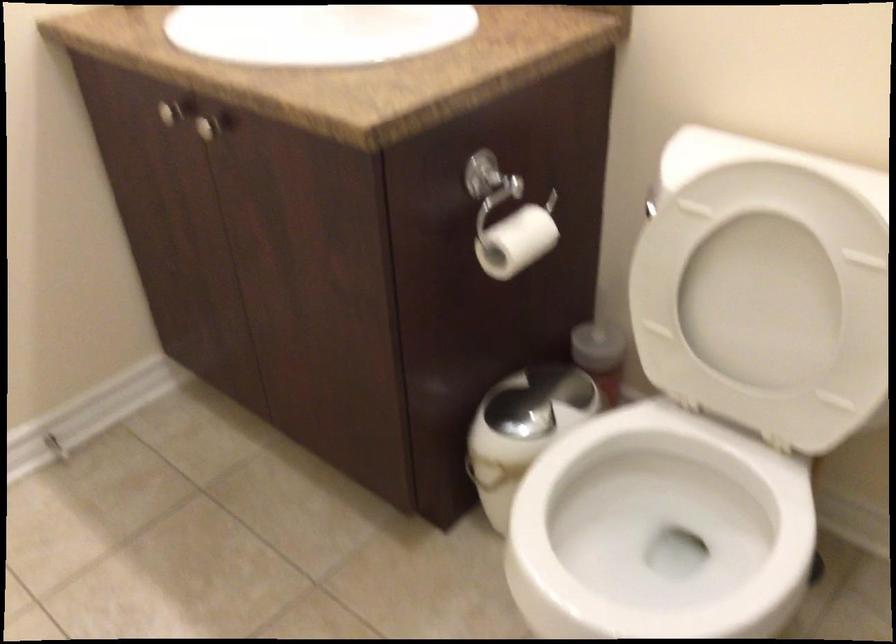
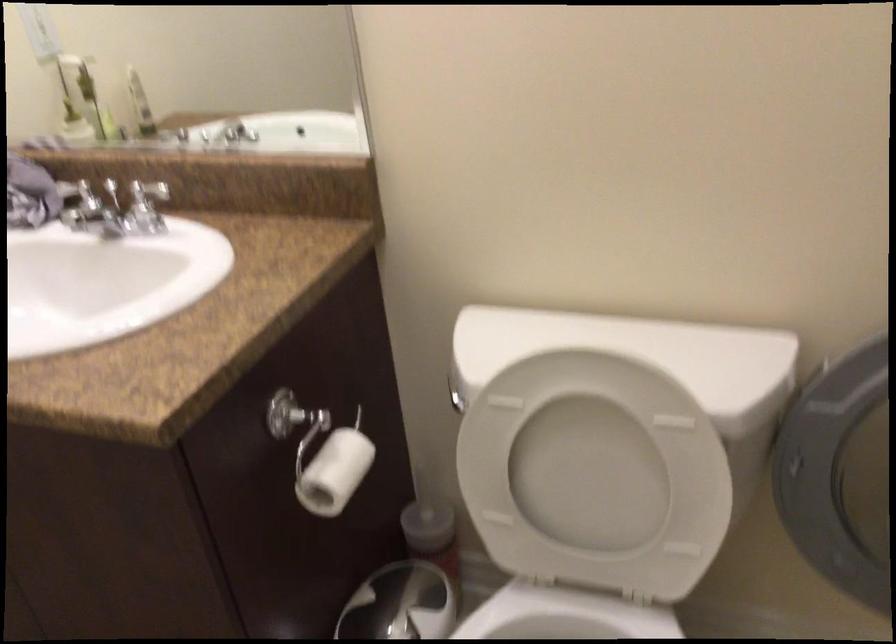
Where in the second image is the point corresponding to the point at 693,439 from the first image?

(564, 616)